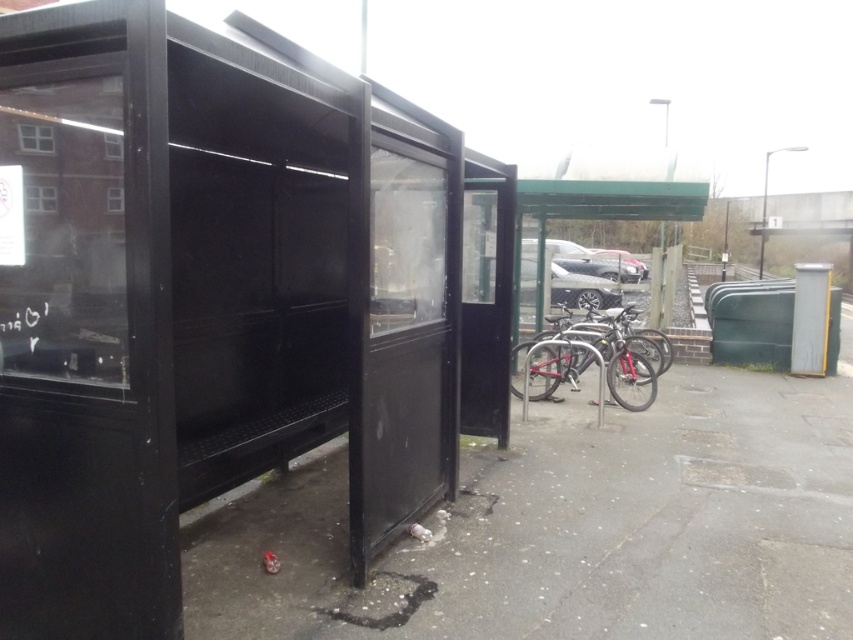
You are a delivery person trying to park your shiny metallic bicycle at center near the black matte bus stop at left. Considering their sizes, will the bicycle fit comfortably next to the bus stop without blocking the entrance?

The black matte bus stop at left is bigger than the shiny metallic bicycle at center. Since the bus stop is larger, there should be enough space for the bicycle to park next to it without blocking the entrance.

You are a delivery person trying to reach the shiny metallic bicycle at center. You are currently standing next to the black matte bus stop at left. Which direction should you move to get to the bicycle?

Since the black matte bus stop at left has a greater height compared to the shiny metallic bicycle at center, you should move to the right to reach the shiny metallic bicycle at center from the black matte bus stop at left.